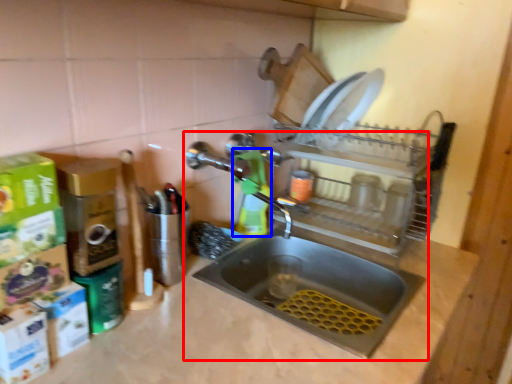
Question: Which object appears closest to the camera in this image, sink (highlighted by a red box) or cleaning product (highlighted by a blue box)?

Choices:
 (A) sink
 (B) cleaning product

Answer: (A)